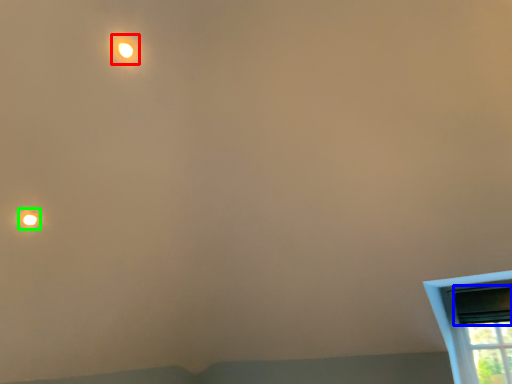
Question: Based on their relative distances, which object is farther from light (highlighted by a red box)? Choose from window screen (highlighted by a blue box) and droplight (highlighted by a green box).

Choices:
 (A) window screen
 (B) droplight

Answer: (A)